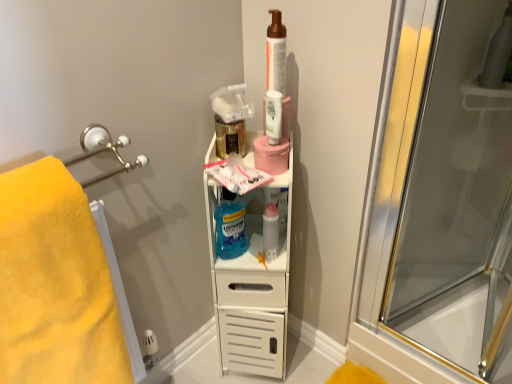
Question: From a real-world perspective, is matte brown pump bottle at upper center positioned above or below yellow soft towel at left?

Choices:
 (A) below
 (B) above

Answer: (B)

Question: Considering the positions of matte brown pump bottle at upper center and yellow soft towel at left in the image, is matte brown pump bottle at upper center taller or shorter than yellow soft towel at left?

Choices:
 (A) tall
 (B) short

Answer: (B)

Question: Which object is the farthest from the white plastic shelf at center?

Choices:
 (A) transparent glass screen door at right
 (B) yellow soft towel at left
 (C) translucent plastic mouthwash at center, positioned as the second mouthwash in front-to-back order
 (D) blue translucent liquid mouthwash at center
 (E) translucent plastic mouthwash at upper center, which appears as the second mouthwash when ordered from the bottom

Answer: (A)

Question: Which is farther from the blue translucent liquid mouthwash at center?

Choices:
 (A) translucent plastic mouthwash at center, positioned as the second mouthwash in front-to-back order
 (B) transparent glass screen door at right
 (C) matte brown pump bottle at upper center
 (D) white plastic shelf at center
 (E) translucent plastic mouthwash at upper center, which appears as the second mouthwash when ordered from the bottom

Answer: (B)